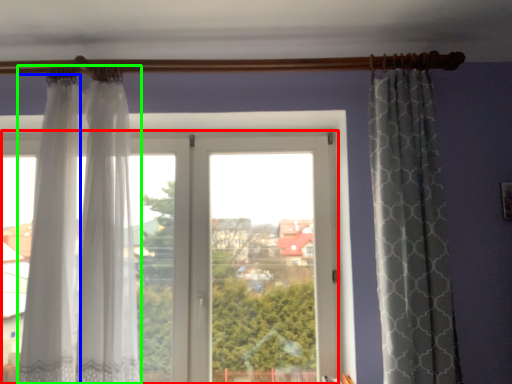
Question: Based on their relative distances, which object is farther from window (highlighted by a red box)? Choose from curtain (highlighted by a blue box) and curtain (highlighted by a green box).

Choices:
 (A) curtain
 (B) curtain

Answer: (A)